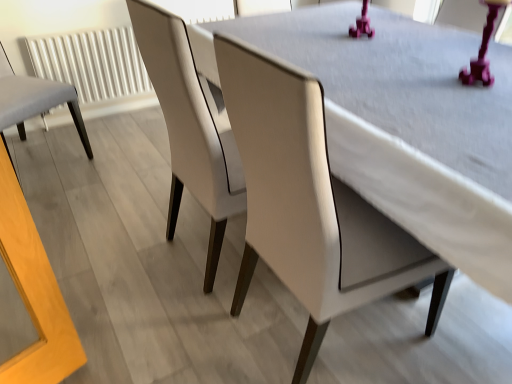
This screenshot has height=384, width=512. What are the coordinates of `free point below light gray fabric chair at left, which appears as the third chair when viewed from the right (from a real-world perspective)` in the screenshot? It's located at (39, 160).